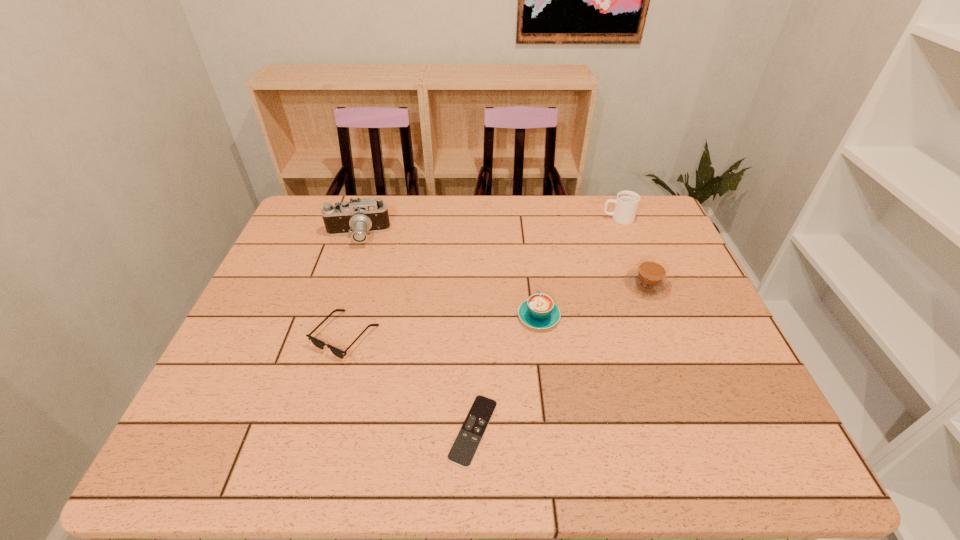
Locate an element on the screen. The width and height of the screenshot is (960, 540). free space at the far left corner is located at coordinates (305, 223).

In the image, there is a desktop. Where is `vacant space at the far right corner`? Image resolution: width=960 pixels, height=540 pixels. vacant space at the far right corner is located at coordinates (663, 231).

You are a GUI agent. You are given a task and a screenshot of the screen. Output one action in this format:
    pyautogui.click(x=<x>, y=<y>)
    Task: Click on the vacant space at the near right corner of the desktop
    This screenshot has width=960, height=540.
    Given the screenshot: What is the action you would take?
    pyautogui.click(x=717, y=449)

This screenshot has height=540, width=960. Identify the location of free space between the shortest cappuccino and the sunglasses. (442, 326).

At what (x,y) coordinates should I click in order to perform the action: click on free space between the third object from right to left and the second tallest object. Please return your answer as a coordinate pair (x, y). Looking at the image, I should click on (578, 267).

Image resolution: width=960 pixels, height=540 pixels. Identify the location of free space between the fourth object from right to left and the second tallest cappuccino. (561, 357).

Locate an element on the screen. The image size is (960, 540). free area in between the tallest object and the second shortest cappuccino is located at coordinates (502, 260).

The image size is (960, 540). What are the coordinates of `vacant space that is in between the camera and the nearest object` in the screenshot? It's located at (415, 333).

The width and height of the screenshot is (960, 540). What are the coordinates of `empty space that is in between the shortest cappuccino and the farthest cappuccino` in the screenshot? It's located at (578, 267).

In order to click on free spot between the second shortest object and the third object from left to right in this screenshot , I will do `click(409, 383)`.